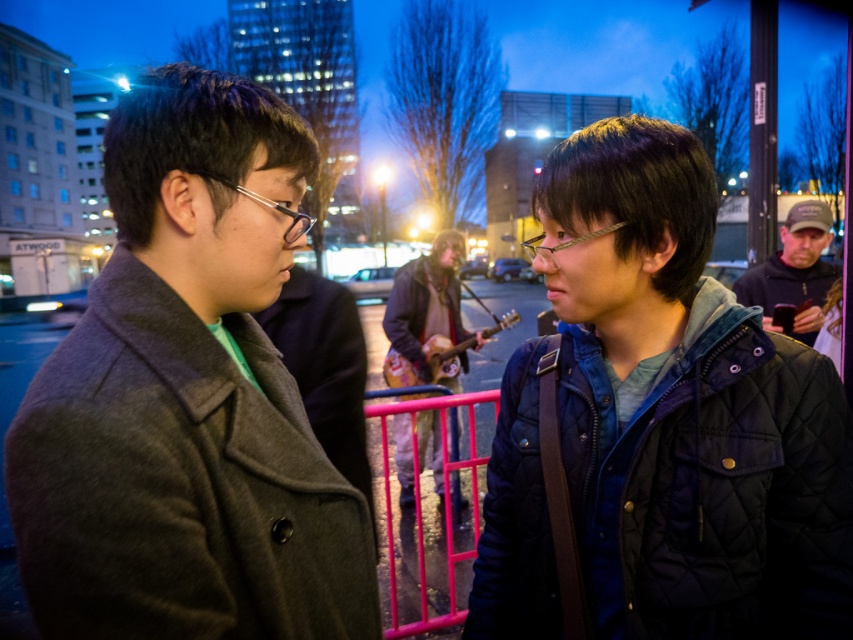
Where is the quilted dark blue jacket at center located in the image?

The quilted dark blue jacket at center is located at point (660, 422) in the image.